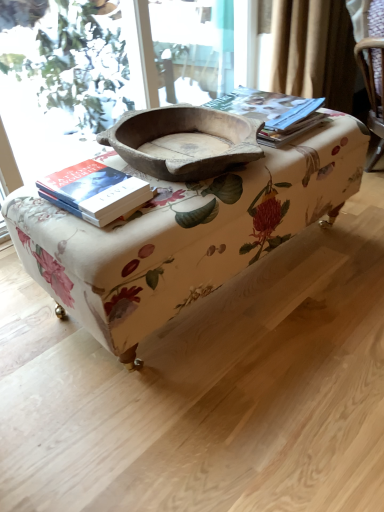
Identify the location of vacant area in front of hardcover book at left. pos(93,234).